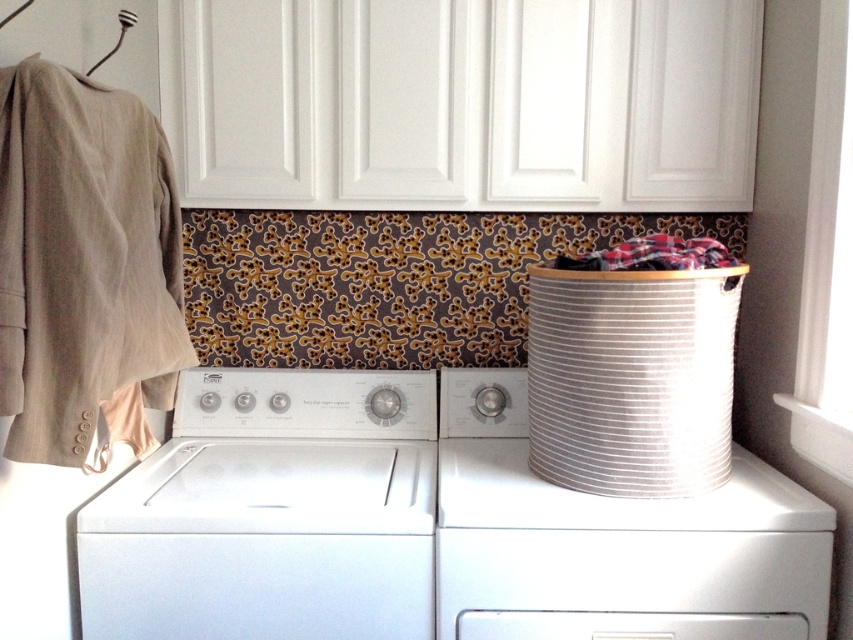
You are organizing the laundry room and need to place a new shelf between the beige wool coat at left and the white striped fabric laundry basket at right. Based on their positions, where should the shelf be placed?

The beige wool coat at left is above the white striped fabric laundry basket at right, so the shelf should be placed below the coat and above the laundry basket to fit between them.

You are organizing the laundry room and need to access the metallic fork at upper left. However, the beige wool coat at left is blocking it. Can you move the coat to reach the fork?

The beige wool coat at left is in front of the metallic fork at upper left, so moving the coat would allow access to the fork.